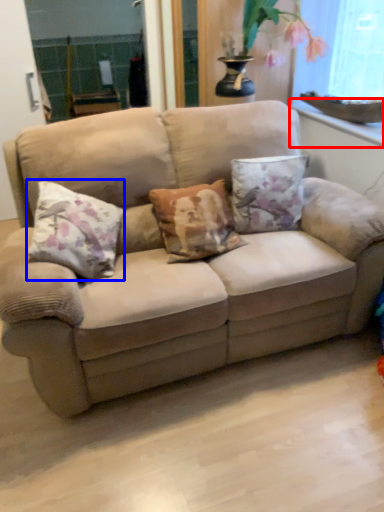
Question: Which object appears closest to the camera in this image, window sill (highlighted by a red box) or pillow (highlighted by a blue box)?

Choices:
 (A) window sill
 (B) pillow

Answer: (B)